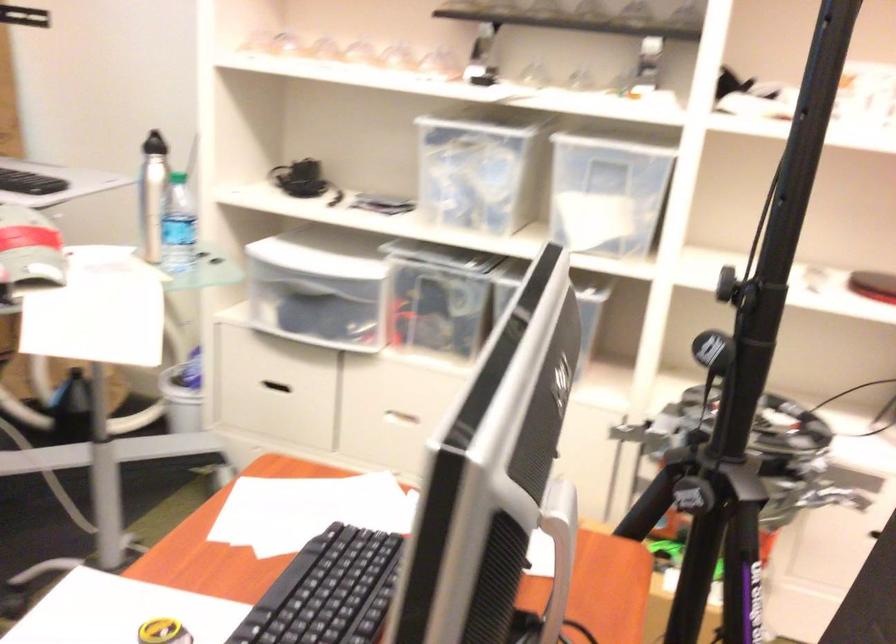
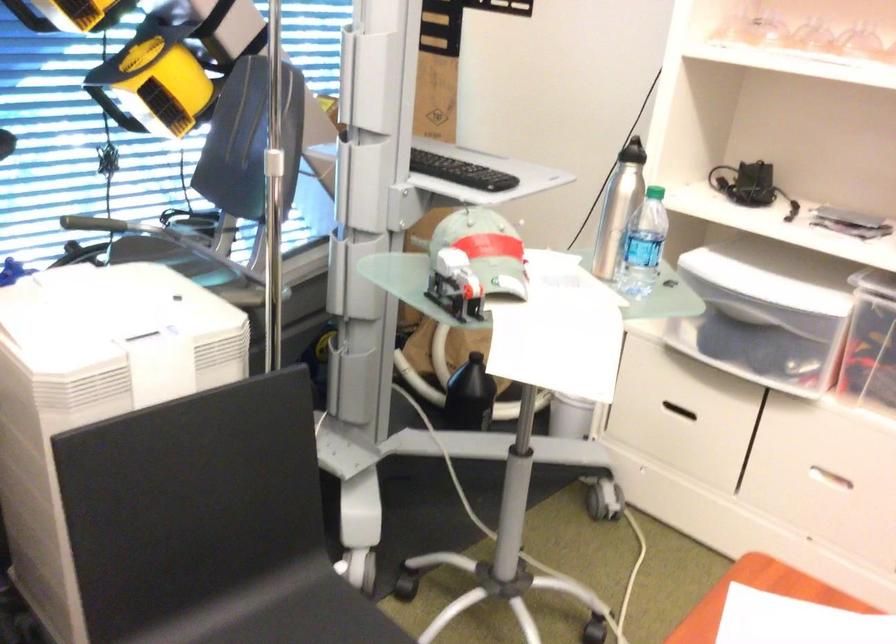
Locate, in the second image, the point that corresponds to [270,392] in the first image.

(677, 411)